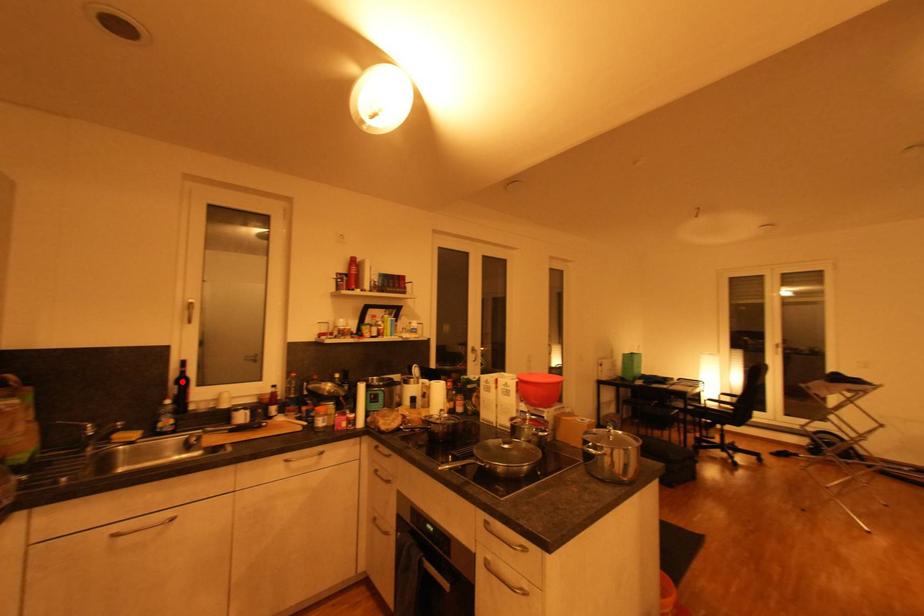
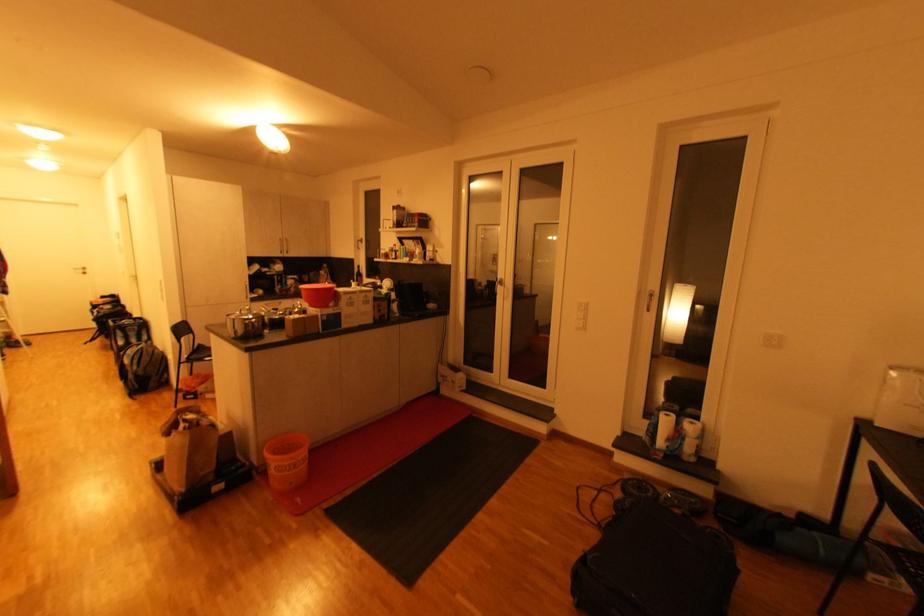
In the second image, find the point that corresponds to the highlighted location in the first image.

(361, 275)